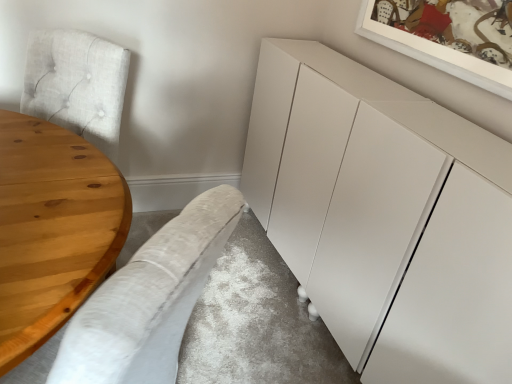
Question: From the image's perspective, is natural wood table at left under light gray fabric couch at lower left?

Choices:
 (A) yes
 (B) no

Answer: (B)

Question: Is natural wood table at left not inside light gray fabric couch at lower left?

Choices:
 (A) no
 (B) yes

Answer: (A)

Question: Is natural wood table at left in front of light gray fabric couch at lower left?

Choices:
 (A) no
 (B) yes

Answer: (A)

Question: Is natural wood table at left oriented towards light gray fabric couch at lower left?

Choices:
 (A) yes
 (B) no

Answer: (A)

Question: Would you consider natural wood table at left to be distant from light gray fabric couch at lower left?

Choices:
 (A) no
 (B) yes

Answer: (A)

Question: Does point pyautogui.click(x=69, y=175) appear closer or farther from the camera than point pyautogui.click(x=154, y=269)?

Choices:
 (A) closer
 (B) farther

Answer: (B)

Question: Looking at their shapes, would you say natural wood table at left is wider or thinner than light gray fabric couch at lower left?

Choices:
 (A) wide
 (B) thin

Answer: (B)

Question: From a real-world perspective, is natural wood table at left above or below light gray fabric couch at lower left?

Choices:
 (A) above
 (B) below

Answer: (B)

Question: From the image's perspective, is natural wood table at left above or below light gray fabric couch at lower left?

Choices:
 (A) below
 (B) above

Answer: (B)

Question: Considering the positions of point (165, 322) and point (19, 294), is point (165, 322) closer or farther from the camera than point (19, 294)?

Choices:
 (A) farther
 (B) closer

Answer: (B)

Question: In the image, is light gray fabric couch at lower left on the left side or the right side of natural wood table at left?

Choices:
 (A) left
 (B) right

Answer: (B)

Question: Considering their positions, is light gray fabric couch at lower left located in front of or behind natural wood table at left?

Choices:
 (A) front
 (B) behind

Answer: (A)

Question: From the image's perspective, is light gray fabric couch at lower left above or below natural wood table at left?

Choices:
 (A) below
 (B) above

Answer: (A)

Question: In terms of size, does natural wood table at left appear bigger or smaller than white matte cabinet at center?

Choices:
 (A) big
 (B) small

Answer: (B)

Question: Is point (0, 122) positioned closer to the camera than point (251, 119)?

Choices:
 (A) closer
 (B) farther

Answer: (A)